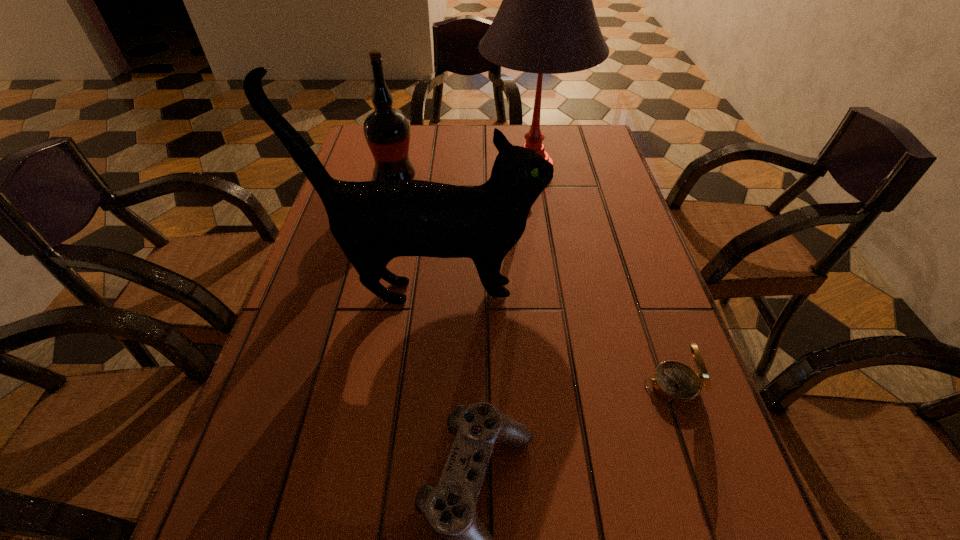
Find the location of a particular element. vacant region at the right edge of the desktop is located at coordinates (717, 491).

The image size is (960, 540). Find the location of `vacant area at the far right corner of the desktop`. vacant area at the far right corner of the desktop is located at coordinates (580, 124).

In order to click on unoccupied position between the second shortest object and the cat in this screenshot , I will do `click(551, 339)`.

Identify the location of unoccupied position between the fourth tallest object and the third tallest object. Image resolution: width=960 pixels, height=540 pixels. (534, 282).

At what (x,y) coordinates should I click in order to perform the action: click on unoccupied position between the third shortest object and the table lamp. Please return your answer as a coordinate pair (x, y). The width and height of the screenshot is (960, 540). Looking at the image, I should click on (464, 174).

The width and height of the screenshot is (960, 540). I want to click on free space between the wine bottle and the second nearest object, so click(x=534, y=282).

This screenshot has width=960, height=540. Find the location of `free spot between the fourth tallest object and the third farthest object`. free spot between the fourth tallest object and the third farthest object is located at coordinates (551, 339).

You are a GUI agent. You are given a task and a screenshot of the screen. Output one action in this format:
    pyautogui.click(x=<x>, y=<y>)
    Task: Click on the object that stands as the third closest to the fourth tallest object
    This screenshot has width=960, height=540.
    Given the screenshot: What is the action you would take?
    pyautogui.click(x=546, y=24)

Where is `the closest object to the nearest object`? the closest object to the nearest object is located at coordinates (677, 383).